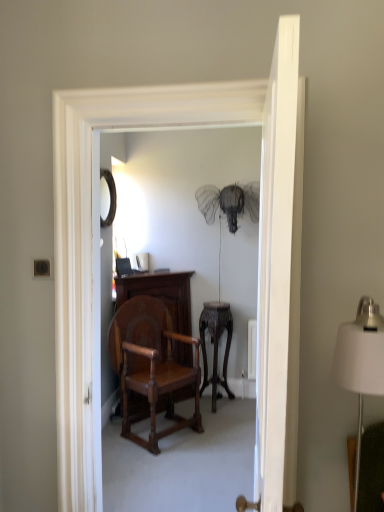
Question: Is there a large distance between matte black mirror at upper left and dark wood side table at center?

Choices:
 (A) no
 (B) yes

Answer: (B)

Question: From the image's perspective, is matte black mirror at upper left below dark wood side table at center?

Choices:
 (A) yes
 (B) no

Answer: (B)

Question: Is matte black mirror at upper left next to dark wood side table at center?

Choices:
 (A) no
 (B) yes

Answer: (A)

Question: Can you confirm if matte black mirror at upper left is positioned to the right of dark wood side table at center?

Choices:
 (A) no
 (B) yes

Answer: (A)

Question: Does matte black mirror at upper left have a lesser width compared to dark wood side table at center?

Choices:
 (A) no
 (B) yes

Answer: (B)

Question: Is matte black mirror at upper left outside dark wood side table at center?

Choices:
 (A) yes
 (B) no

Answer: (A)

Question: Is matte black mirror at upper left wider than white fabric lampshade at right?

Choices:
 (A) yes
 (B) no

Answer: (B)

Question: Considering the relative positions of matte black mirror at upper left and white fabric lampshade at right in the image provided, is matte black mirror at upper left to the left of white fabric lampshade at right from the viewer's perspective?

Choices:
 (A) yes
 (B) no

Answer: (A)

Question: From the image's perspective, is matte black mirror at upper left located beneath white fabric lampshade at right?

Choices:
 (A) no
 (B) yes

Answer: (A)

Question: Is matte black mirror at upper left facing towards white fabric lampshade at right?

Choices:
 (A) yes
 (B) no

Answer: (B)

Question: Is matte black mirror at upper left surrounding white fabric lampshade at right?

Choices:
 (A) no
 (B) yes

Answer: (A)

Question: Considering the relative positions of matte black mirror at upper left and white fabric lampshade at right in the image provided, is matte black mirror at upper left in front of white fabric lampshade at right?

Choices:
 (A) no
 (B) yes

Answer: (A)

Question: Is matte black mirror at upper left smaller than polished wood vanity at center?

Choices:
 (A) no
 (B) yes

Answer: (B)